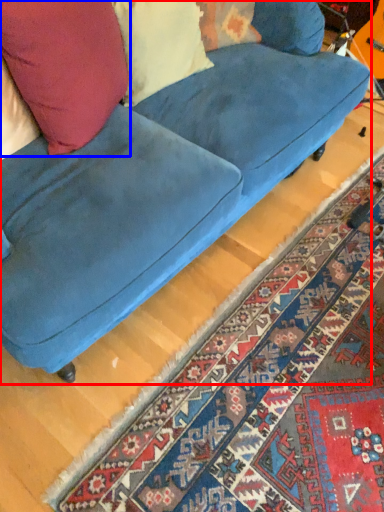
Question: Which point is closer to the camera, studio couch (highlighted by a red box) or throw pillow (highlighted by a blue box)?

Choices:
 (A) studio couch
 (B) throw pillow

Answer: (A)